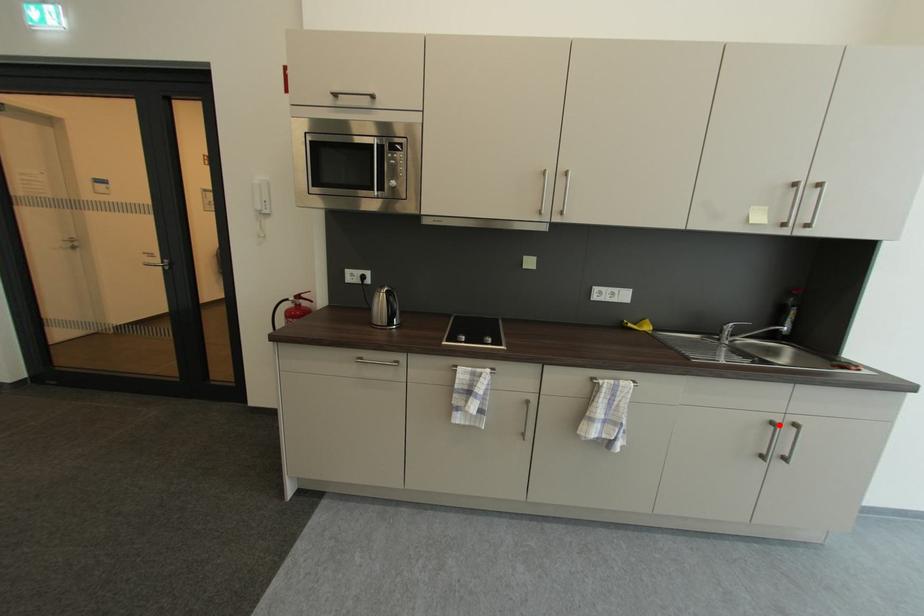
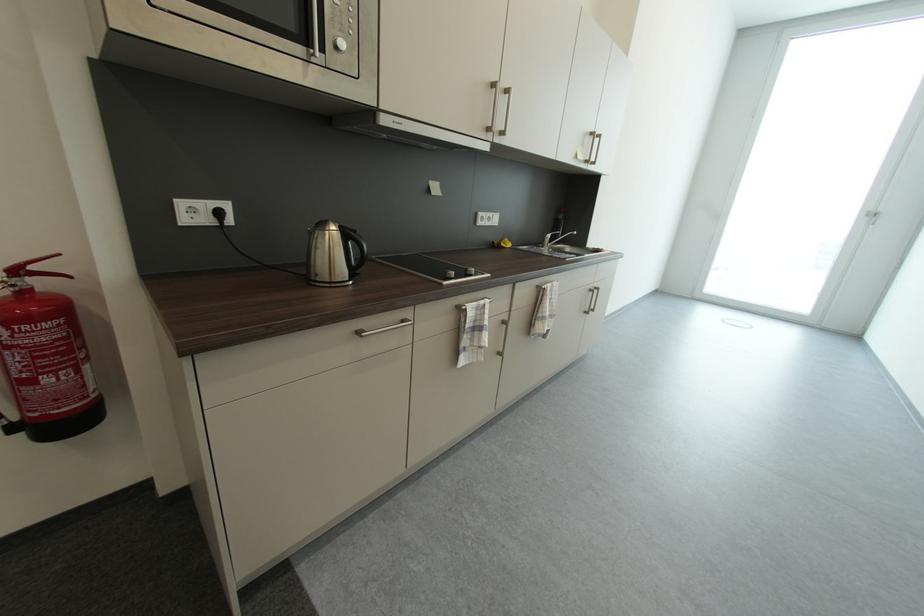
Question: I am providing you with two images of the same scene from different viewpoints. Image1 has a red point marked. In image2, the corresponding 3D location appears at what relative position? Reply with the corresponding letter.

Choices:
 (A) Closer
 (B) Farther

Answer: (B)